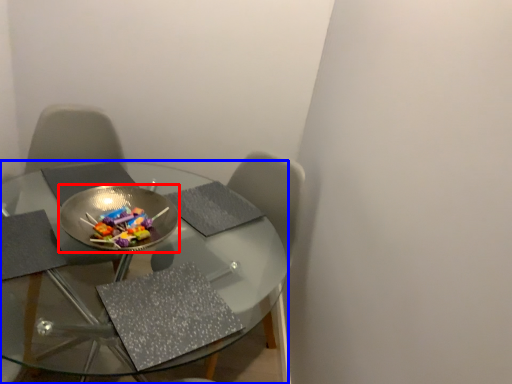
Question: Which point is further to the camera, bowl (highlighted by a red box) or table (highlighted by a blue box)?

Choices:
 (A) bowl
 (B) table

Answer: (A)